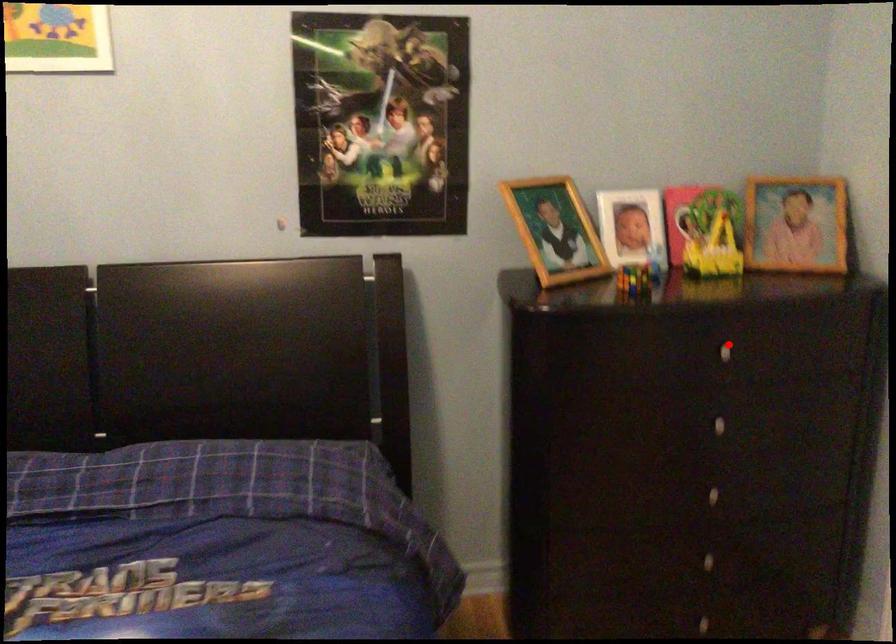
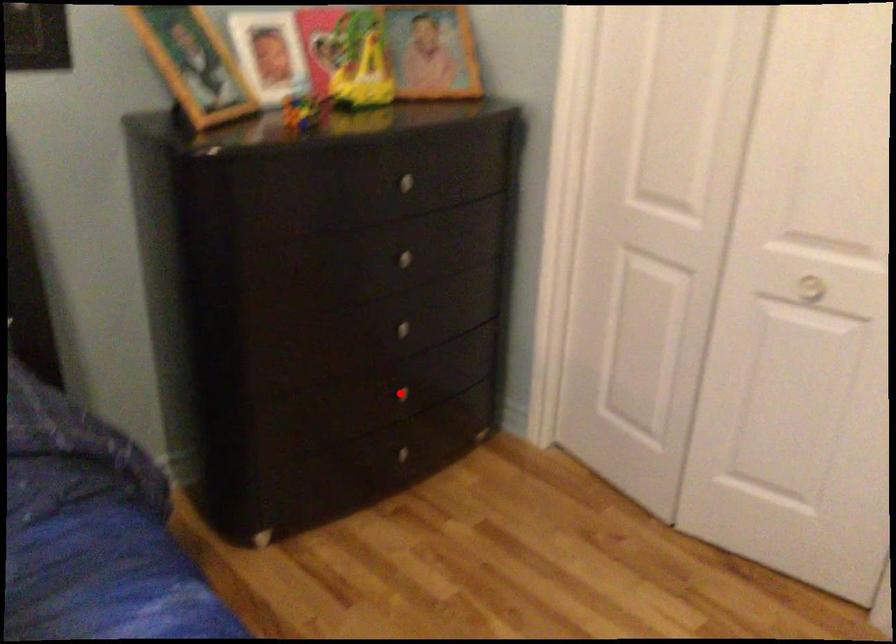
I am providing you with two images of the same scene from different viewpoints. A red point is marked on the first image and another point is marked on the second image. Does the point marked in image1 correspond to the same location as the one in image2?

No